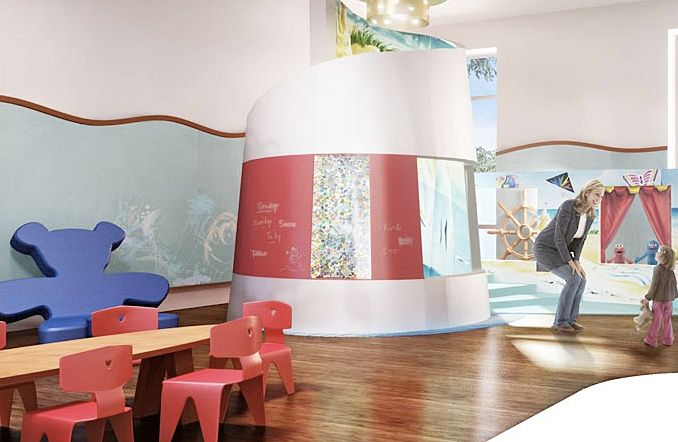
At what (x,y) coordinates should I click in order to perform the action: click on hardwood floor. Please return your answer as a coordinate pair (x, y). The height and width of the screenshot is (442, 678). Looking at the image, I should click on (372, 397), (437, 361), (356, 359), (468, 397).